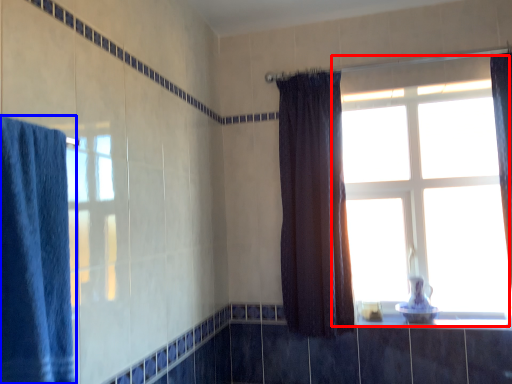
Question: Which point is further to the camera, window (highlighted by a red box) or curtain (highlighted by a blue box)?

Choices:
 (A) window
 (B) curtain

Answer: (A)